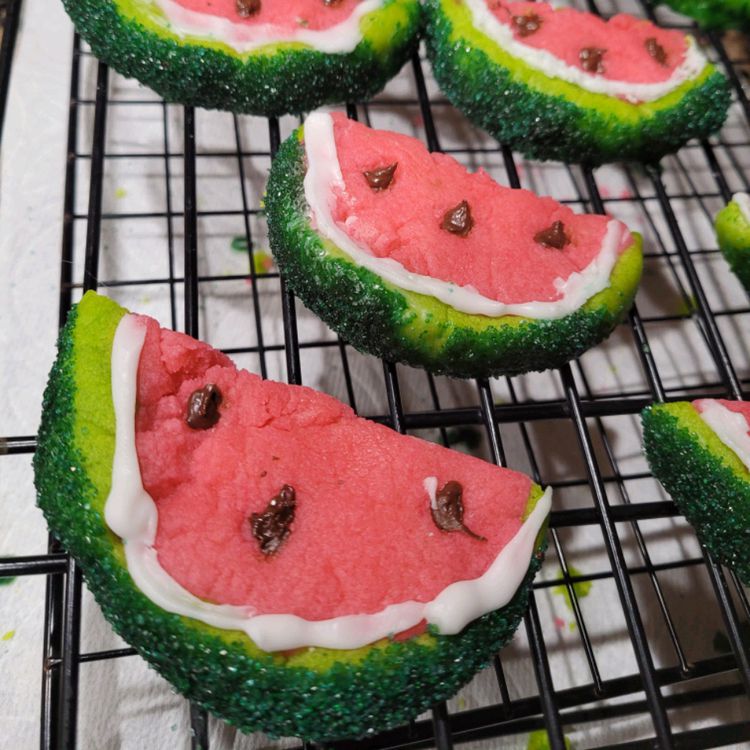
In order to click on table in this screenshot , I will do `click(733, 46)`.